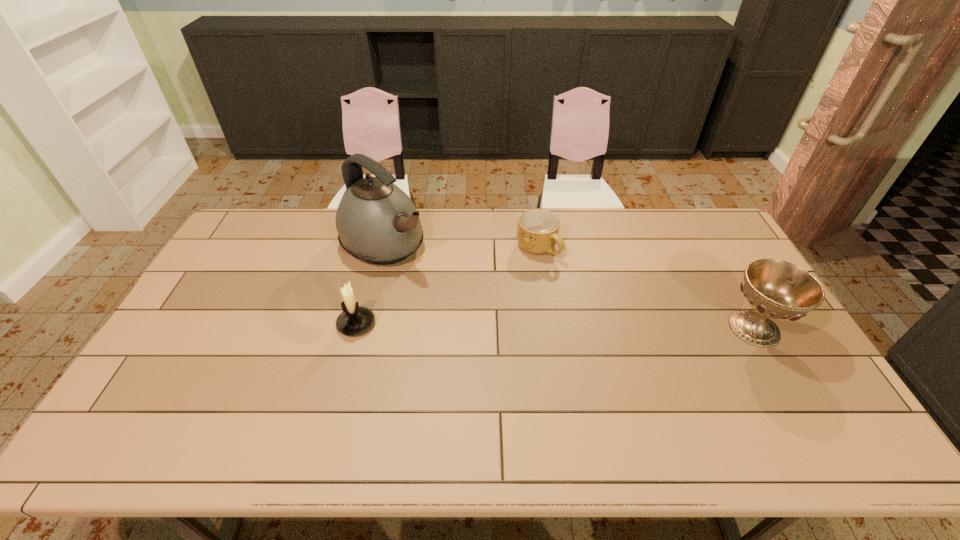
This screenshot has height=540, width=960. What are the coordinates of `free spot on the desktop that is between the candle holder and the rightmost object and is positioned at the spout of the kettle` in the screenshot? It's located at (504, 326).

Locate an element on the screen. The height and width of the screenshot is (540, 960). free space on the desktop that is between the candle holder and the rightmost object and is positioned on the side with the handle of the mug is located at coordinates (611, 327).